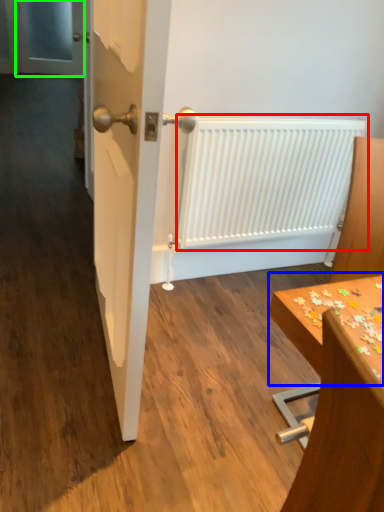
Question: Estimate the real-world distances between objects in this image. Which object is closer to radiator (highlighted by a red box), table (highlighted by a blue box) or screen door (highlighted by a green box)?

Choices:
 (A) table
 (B) screen door

Answer: (A)